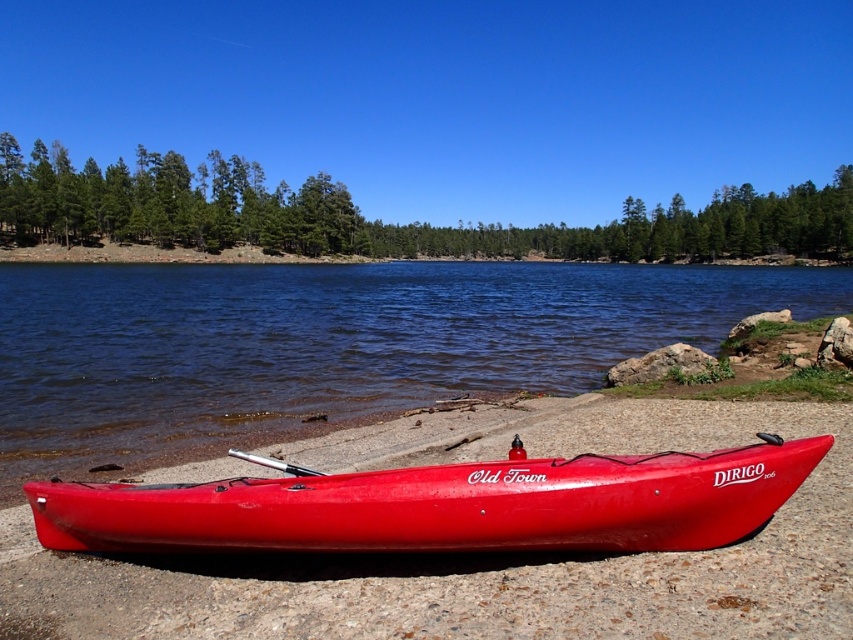
You are planning to take a photo of the glossy water at center and the glossy red kayak at lower center from a position above them. Which object will appear taller in your photo?

The glossy water at center appears taller in the photo because it has a greater height compared to the glossy red kayak at lower center according to the description.